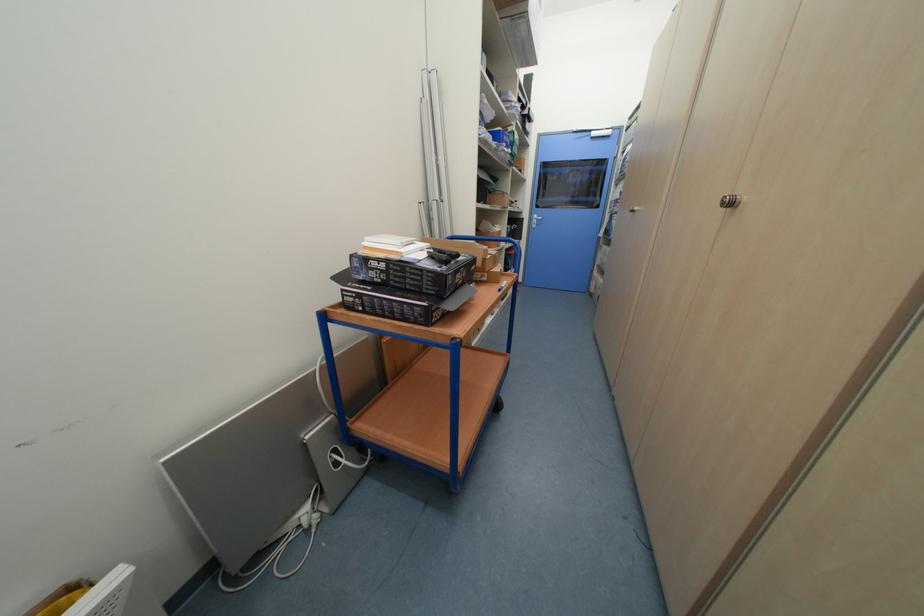
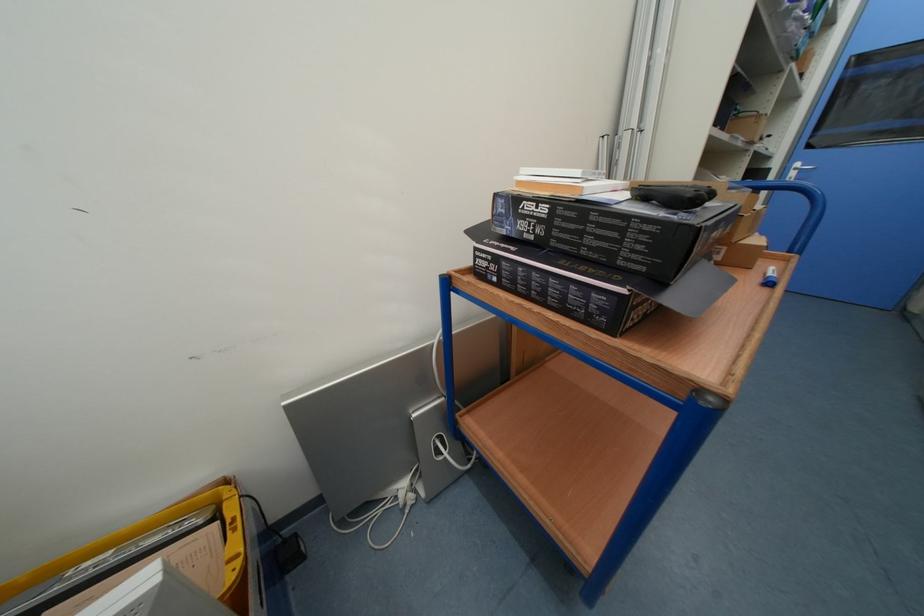
Find the pixel in the second image that matches point (379, 270) in the first image.

(530, 217)